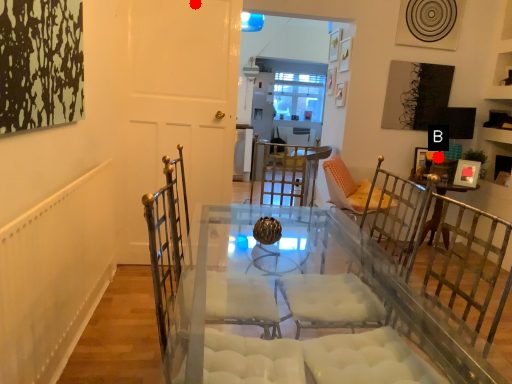
Question: Two points are circled on the image, labeled by A and B beside each circle. Which point is closer to the camera?

Choices:
 (A) A is closer
 (B) B is closer

Answer: (A)